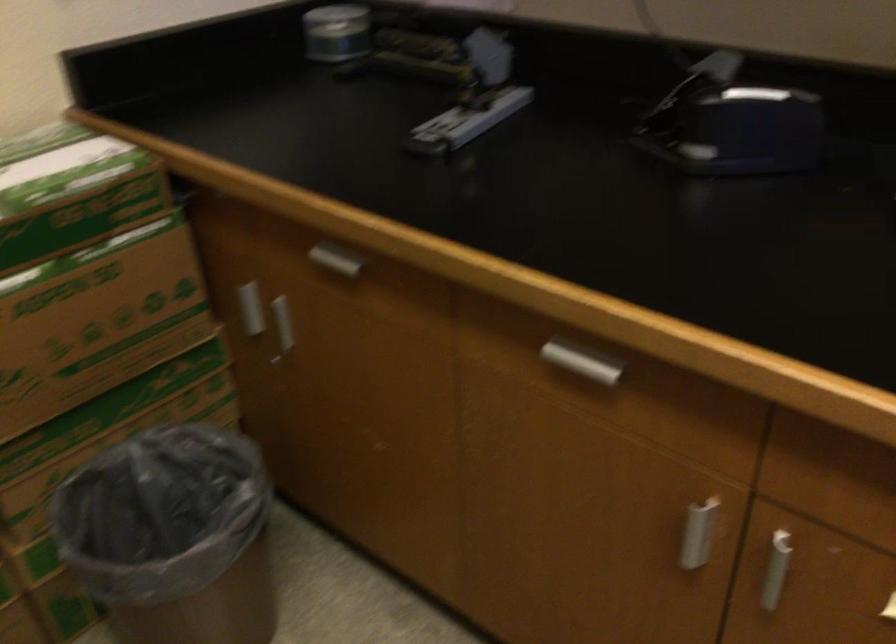
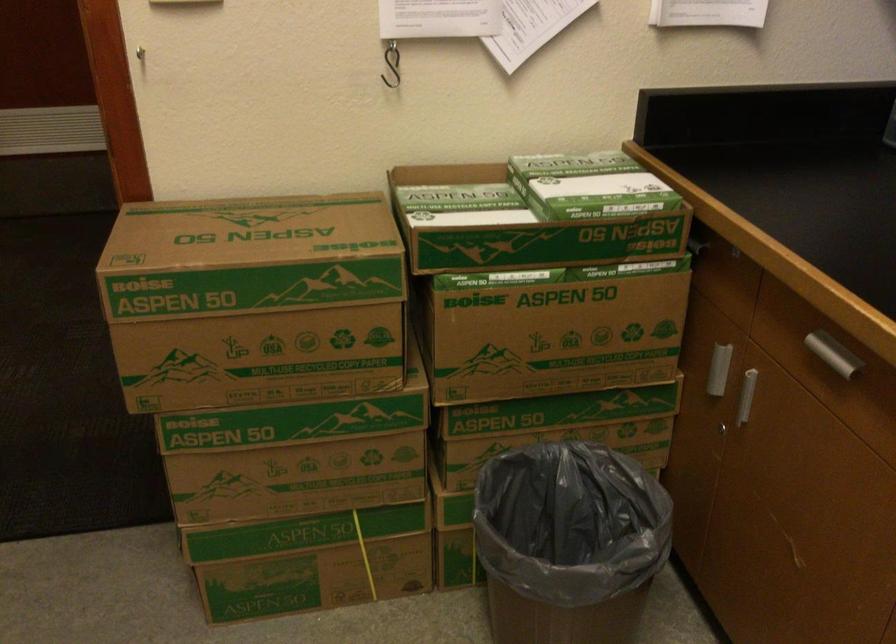
In the second image, find the point that corresponds to point (176, 504) in the first image.

(570, 521)